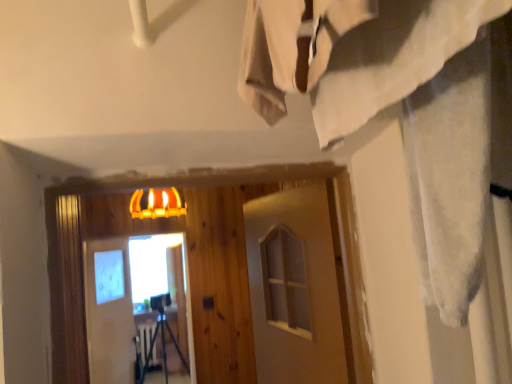
Question: Can you confirm if white matte barn door at center, positioned as the 1th barn door in front-to-back order, is shorter than white matte barn door at center, the 1th barn door in the left-to-right sequence?

Choices:
 (A) no
 (B) yes

Answer: (B)

Question: From the image's perspective, is white matte barn door at center, which appears as the second barn door when viewed from the back, below white matte barn door at center, the 2th barn door viewed from the front?

Choices:
 (A) yes
 (B) no

Answer: (B)

Question: Does white matte barn door at center, marked as the 2th barn door in a left-to-right arrangement, come behind white matte barn door at center, which ranks as the first barn door in back-to-front order?

Choices:
 (A) yes
 (B) no

Answer: (B)

Question: Could white matte barn door at center, which is the 2th barn door in right-to-left order, be considered to be inside white matte barn door at center, marked as the 2th barn door in a left-to-right arrangement?

Choices:
 (A) no
 (B) yes

Answer: (A)

Question: Considering the relative sizes of white matte barn door at center, which is counted as the first barn door, starting from the right, and white matte barn door at center, which ranks as the first barn door in back-to-front order, in the image provided, is white matte barn door at center, which is counted as the first barn door, starting from the right, wider than white matte barn door at center, which ranks as the first barn door in back-to-front order,?

Choices:
 (A) yes
 (B) no

Answer: (B)

Question: In the image, is matte glass screen door at center positioned in front of or behind white matte barn door at center, positioned as the 1th barn door in front-to-back order?

Choices:
 (A) behind
 (B) front

Answer: (A)

Question: From a real-world perspective, is matte glass screen door at center above or below white matte barn door at center, positioned as the 1th barn door in front-to-back order?

Choices:
 (A) below
 (B) above

Answer: (A)

Question: From the image's perspective, is matte glass screen door at center positioned above or below white matte barn door at center, which is counted as the first barn door, starting from the right?

Choices:
 (A) above
 (B) below

Answer: (B)

Question: Considering the positions of point (101, 375) and point (278, 243), is point (101, 375) closer or farther from the camera than point (278, 243)?

Choices:
 (A) closer
 (B) farther

Answer: (B)

Question: Looking at the image, does matte glass screen door at center seem bigger or smaller compared to yellow matte lamp at upper center?

Choices:
 (A) small
 (B) big

Answer: (B)

Question: Is point (89, 241) closer or farther from the camera than point (138, 211)?

Choices:
 (A) closer
 (B) farther

Answer: (B)

Question: In the image, is matte glass screen door at center positioned in front of or behind yellow matte lamp at upper center?

Choices:
 (A) behind
 (B) front

Answer: (A)

Question: Is matte glass screen door at center situated inside yellow matte lamp at upper center or outside?

Choices:
 (A) outside
 (B) inside

Answer: (A)

Question: Which is correct: white matte barn door at center, the 2th barn door viewed from the front, is inside white matte barn door at center, which appears as the second barn door when viewed from the back, or outside of it?

Choices:
 (A) outside
 (B) inside

Answer: (A)

Question: Considering the positions of white matte barn door at center, which ranks as the first barn door in back-to-front order, and white matte barn door at center, marked as the 2th barn door in a left-to-right arrangement, in the image, is white matte barn door at center, which ranks as the first barn door in back-to-front order, bigger or smaller than white matte barn door at center, marked as the 2th barn door in a left-to-right arrangement,?

Choices:
 (A) small
 (B) big

Answer: (B)